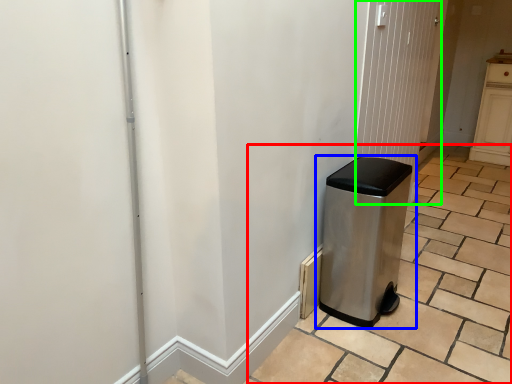
Question: Which object is the closest to the tile (highlighted by a red box)? Choose among these: waste container (highlighted by a blue box) or screen door (highlighted by a green box).

Choices:
 (A) waste container
 (B) screen door

Answer: (A)